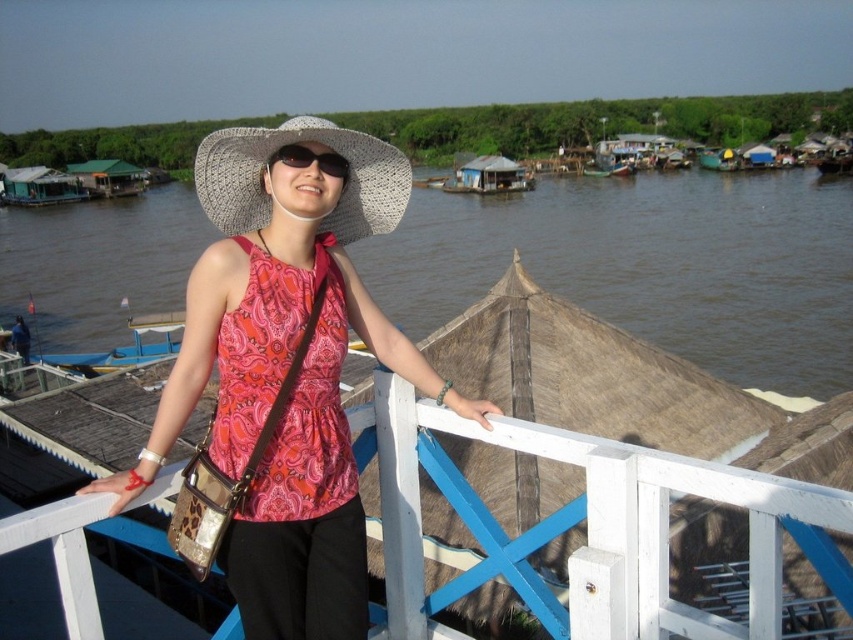
Is brown wooden boat at center taller than blue wooden boat at left?

Correct, brown wooden boat at center is much taller as blue wooden boat at left.

Measure the distance between brown wooden boat at center and blue wooden boat at left.

A distance of 220.92 feet exists between brown wooden boat at center and blue wooden boat at left.

Which is in front, point (714, 339) or point (128, 317)?

Point (128, 317) is more forward.

This screenshot has height=640, width=853. I want to click on brown wooden boat at center, so click(650, 266).

Is blue wooden boat at left bigger than black plastic sunglasses at center?

Correct, blue wooden boat at left is larger in size than black plastic sunglasses at center.

Is point (115, 364) farther from viewer compared to point (334, 168)?

Yes.

Find the location of a particular element. The width and height of the screenshot is (853, 640). blue wooden boat at left is located at coordinates (123, 348).

Find the location of a particular element. The height and width of the screenshot is (640, 853). blue wooden boat at left is located at coordinates (123, 348).

Consider the image. Is matte pink blouse at center further to the viewer compared to black plastic sunglasses at center?

That is False.

Can you confirm if matte pink blouse at center is positioned to the right of black plastic sunglasses at center?

Incorrect, matte pink blouse at center is not on the right side of black plastic sunglasses at center.

Who is more forward, (218, 282) or (277, 148)?

Point (218, 282)

Locate an element on the screen. This screenshot has width=853, height=640. matte pink blouse at center is located at coordinates (287, 368).